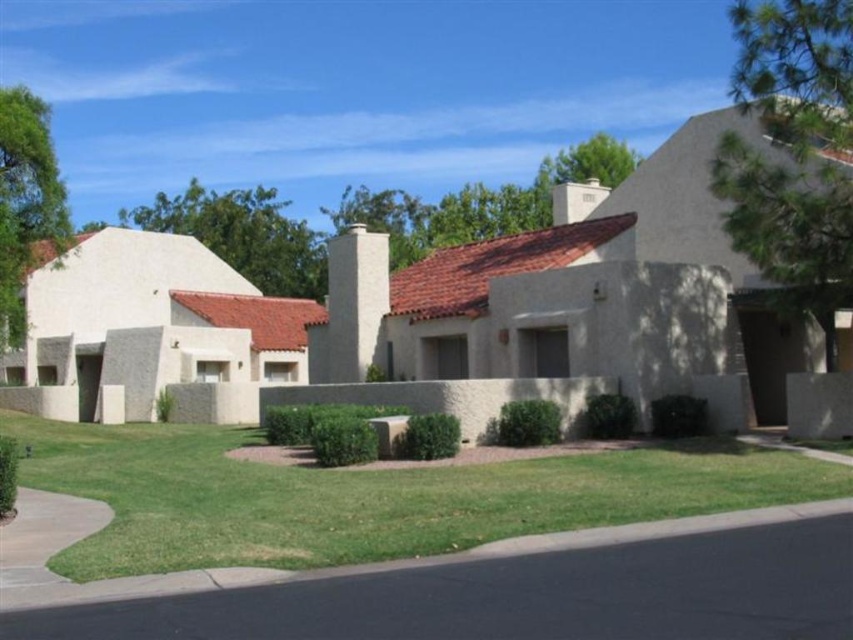
Can you confirm if green grass at lower center is bigger than green leafy tree at upper left?

Incorrect, green grass at lower center is not larger than green leafy tree at upper left.

Between point (630, 513) and point (4, 184), which one is positioned behind?

Point (4, 184)

Locate an element on the screen. green grass at lower center is located at coordinates (369, 496).

Which is more to the right, green grass at lower center or green leafy tree at upper center?

Positioned to the right is green grass at lower center.

Where is `green grass at lower center`? green grass at lower center is located at coordinates (369, 496).

Locate an element on the screen. This screenshot has width=853, height=640. green grass at lower center is located at coordinates (369, 496).

Does green leafy tree at upper center have a greater height compared to green leafy tree at upper left?

Correct, green leafy tree at upper center is much taller as green leafy tree at upper left.

Looking at this image, does green leafy tree at upper center come behind green leafy tree at upper left?

Yes, it is behind green leafy tree at upper left.

Describe the element at coordinates (242, 236) in the screenshot. The image size is (853, 640). I see `green leafy tree at upper center` at that location.

Identify the location of green leafy tree at upper center. (x=242, y=236).